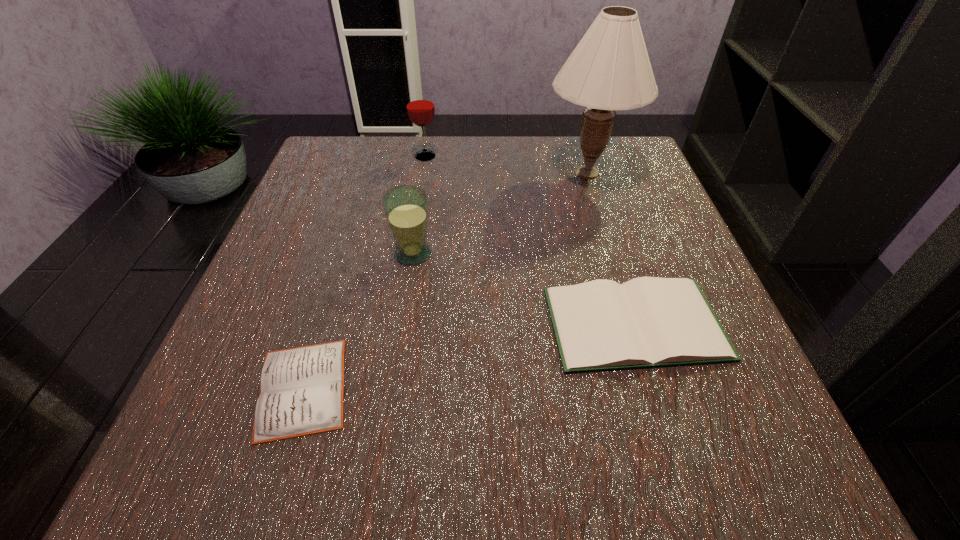
Image resolution: width=960 pixels, height=540 pixels. Find the location of `vacant area that lies between the tallest object and the diary`. vacant area that lies between the tallest object and the diary is located at coordinates (445, 280).

Locate an element on the screen. blank region between the shortest object and the hardback book is located at coordinates (468, 356).

In order to click on vacant point located between the second tallest object and the tallest object in this screenshot , I will do `click(507, 165)`.

This screenshot has height=540, width=960. What are the coordinates of `vacant area that lies between the fourth shortest object and the diary` in the screenshot? It's located at (364, 272).

At what (x,y) coordinates should I click in order to perform the action: click on free space between the hardback book and the nearer glass. Please return your answer as a coordinate pair (x, y). This screenshot has width=960, height=540. Looking at the image, I should click on (524, 288).

I want to click on vacant space that is in between the shortest object and the fourth tallest object, so click(468, 356).

Select which object appears as the second closest to the leftmost object. Please provide its 2D coordinates. Your answer should be formatted as a tuple, i.e. [(x, y)], where the tuple contains the x and y coordinates of a point satisfying the conditions above.

[(648, 322)]

The width and height of the screenshot is (960, 540). I want to click on the closest object to the leftmost object, so click(x=406, y=207).

The image size is (960, 540). I want to click on free space that satisfies the following two spatial constraints: 1. on the front side of the hardback book; 2. on the right side of the nearer glass, so click(402, 323).

Where is `free space that satisfies the following two spatial constraints: 1. on the front side of the farther glass; 2. on the left side of the lampshade`? Image resolution: width=960 pixels, height=540 pixels. free space that satisfies the following two spatial constraints: 1. on the front side of the farther glass; 2. on the left side of the lampshade is located at coordinates pos(422,173).